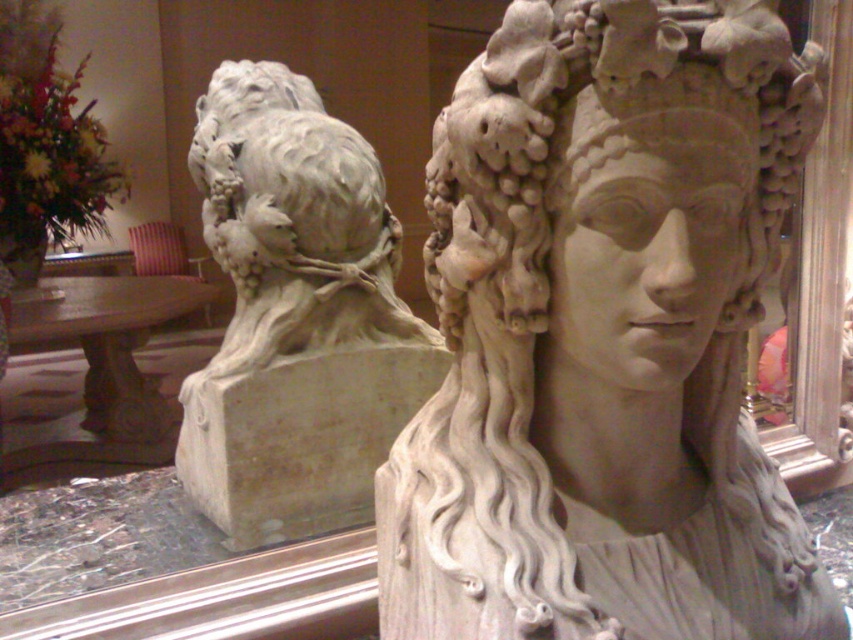
Does white marble lion at center appear over matte stone lion at upper left?

No.

Does point (370, 422) come farther from viewer compared to point (357, 145)?

That is True.

Locate an element on the screen. white marble lion at center is located at coordinates click(296, 316).

Between point (670, 410) and point (366, 172), which one is positioned in front?

Point (670, 410) is in front.

Image resolution: width=853 pixels, height=640 pixels. In order to click on white stone sculpture at center in this screenshot , I will do `click(605, 337)`.

Which is behind, point (548, 388) or point (311, 163)?

The point (311, 163) is behind.

This screenshot has width=853, height=640. What are the coordinates of `white stone sculpture at center` in the screenshot? It's located at (605, 337).

Does white stone sculpture at center have a lesser width compared to white marble lion at center?

Indeed, white stone sculpture at center has a lesser width compared to white marble lion at center.

Does white stone sculpture at center have a greater height compared to white marble lion at center?

Incorrect, white stone sculpture at center's height is not larger of white marble lion at center's.

Is point (543, 300) positioned behind point (265, 236)?

No, it is not.

At what (x,y) coordinates should I click in order to perform the action: click on white stone sculpture at center. Please return your answer as a coordinate pair (x, y). Image resolution: width=853 pixels, height=640 pixels. Looking at the image, I should click on (605, 337).